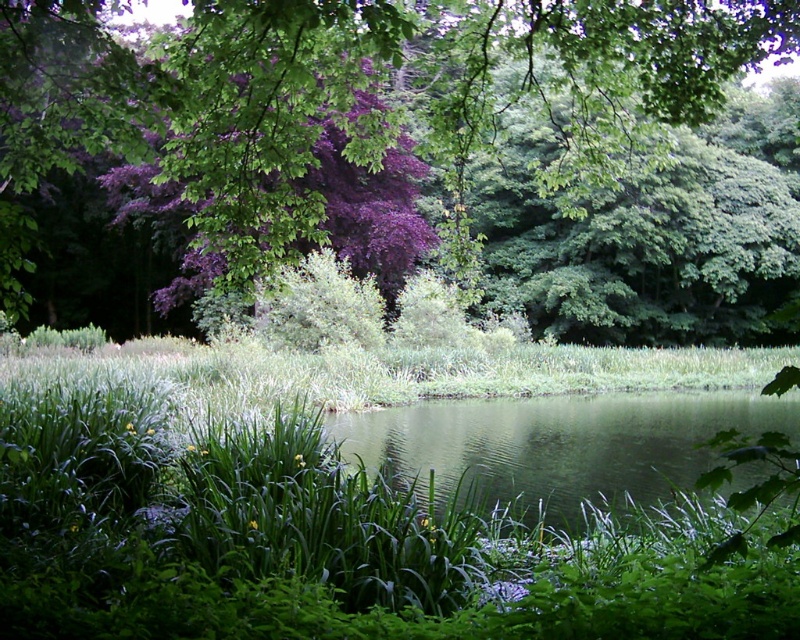
Question: Observing the image, what is the correct spatial positioning of purple leafy tree at upper center in reference to green liquid at center?

Choices:
 (A) above
 (B) below

Answer: (A)

Question: Can you confirm if purple leafy tree at upper center is thinner than green liquid at center?

Choices:
 (A) no
 (B) yes

Answer: (A)

Question: Which point appears farthest from the camera in this image?

Choices:
 (A) (364, 433)
 (B) (300, 10)

Answer: (A)

Question: Which point is closer to the camera?

Choices:
 (A) purple leafy tree at upper center
 (B) green liquid at center

Answer: (A)

Question: Does purple leafy tree at upper center appear under green liquid at center?

Choices:
 (A) no
 (B) yes

Answer: (A)